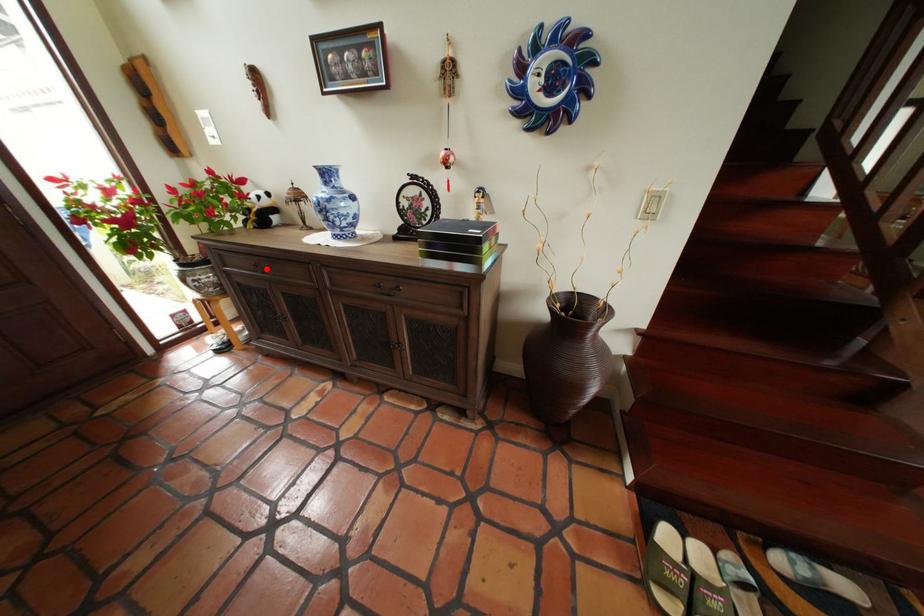
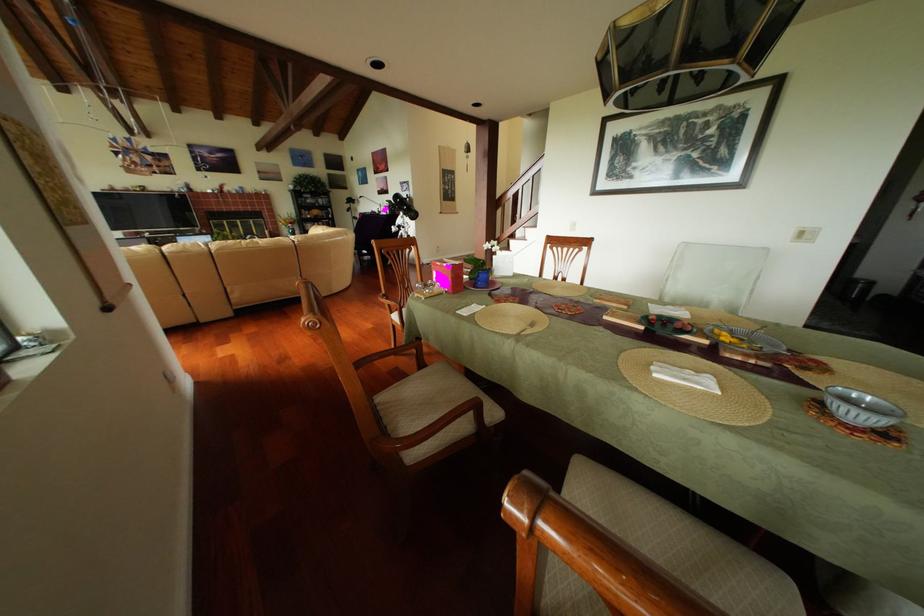
Question: I am providing you with two images of the same scene from different viewpoints. A red point is marked on the first image. Is the red point's position out of view in image 2?

Choices:
 (A) Yes
 (B) No

Answer: (A)